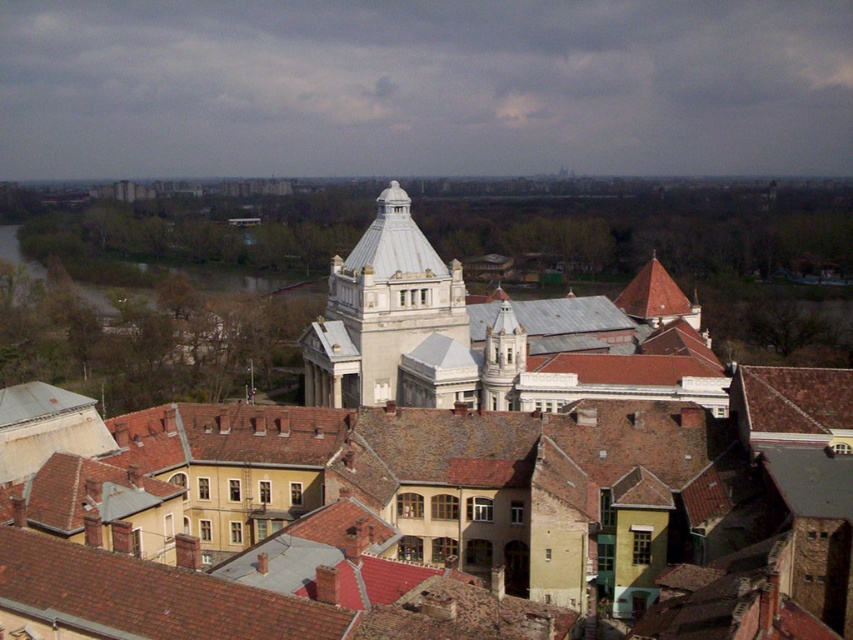
Who is positioned more to the left, white stone building at center or brown muddy water at left?

brown muddy water at left

Which of these two, white stone building at center or brown muddy water at left, stands shorter?

brown muddy water at left

Where is `white stone building at center`? The width and height of the screenshot is (853, 640). white stone building at center is located at coordinates (509, 445).

Where is `white stone building at center`? The image size is (853, 640). white stone building at center is located at coordinates (509, 445).

Between point (366, 301) and point (262, 289), which one is positioned behind?

The point (262, 289) is behind.

Between white marble tower at center and brown muddy water at left, which one appears on the right side from the viewer's perspective?

From the viewer's perspective, white marble tower at center appears more on the right side.

Find the location of a particular element. white marble tower at center is located at coordinates (390, 321).

Does white stone building at center appear on the right side of white marble tower at center?

Yes, white stone building at center is to the right of white marble tower at center.

Between white stone building at center and white marble tower at center, which one appears on the left side from the viewer's perspective?

white marble tower at center

Is point (585, 401) less distant than point (445, 372)?

Yes.

Locate an element on the screen. The width and height of the screenshot is (853, 640). white stone building at center is located at coordinates (509, 445).